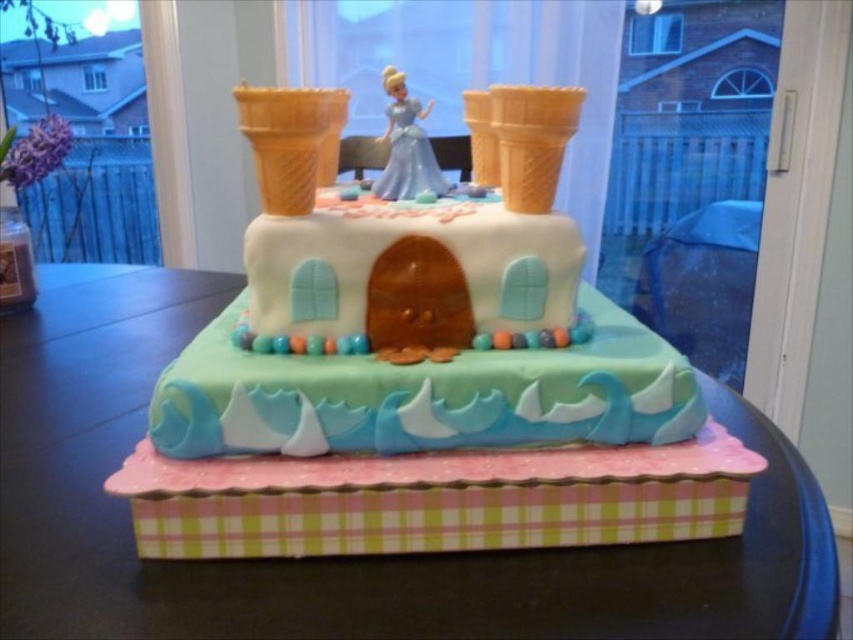
Question: Does smooth white castle at center appear under satin blue dress at center?

Choices:
 (A) yes
 (B) no

Answer: (A)

Question: Which point is farther to the camera?

Choices:
 (A) golden waffle cone at upper right
 (B) golden waffle cone at upper center
 (C) pink paperboard at center

Answer: (A)

Question: Which of these objects is positioned closest to the golden waffle cone at upper center?

Choices:
 (A) pink paperboard at center
 (B) golden waffle cone at upper right

Answer: (B)

Question: Which of the following is the closest to the observer?

Choices:
 (A) smooth white castle at center
 (B) golden waffle cone at upper right

Answer: (A)

Question: Does golden waffle cone at upper center have a greater width compared to golden waffle cone at upper right?

Choices:
 (A) no
 (B) yes

Answer: (B)

Question: Is smooth white castle at center above golden waffle cone at upper center?

Choices:
 (A) yes
 (B) no

Answer: (B)